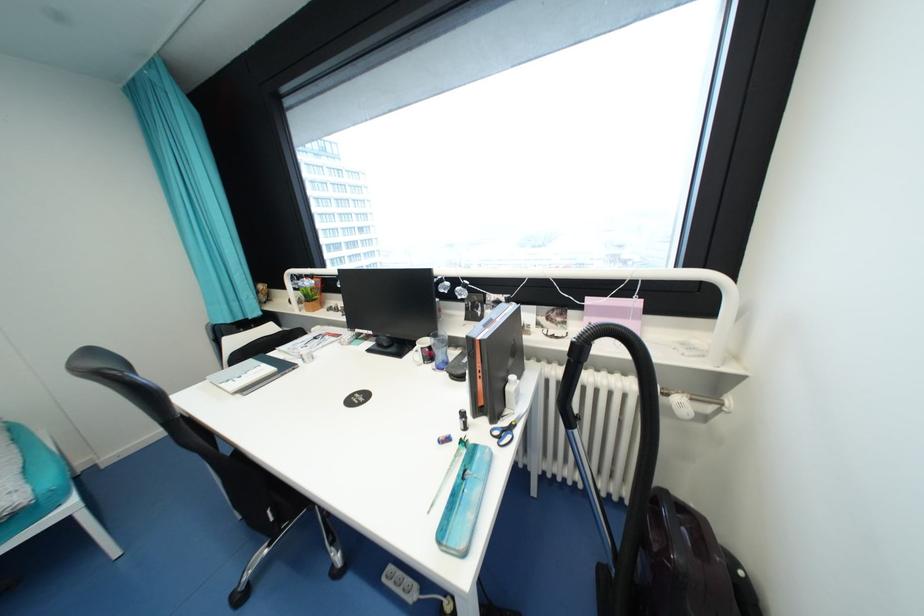
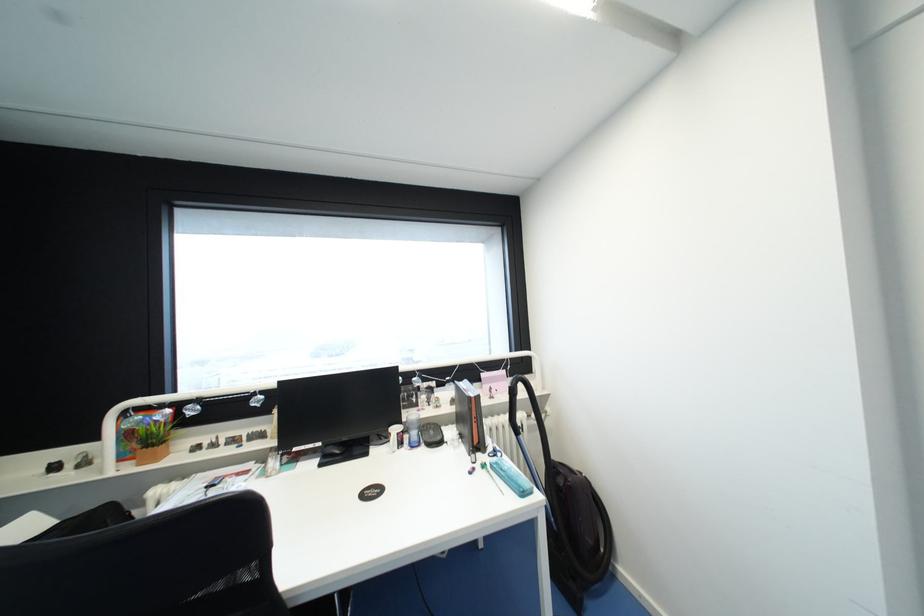
Where in the second image is the point corresponding to (x=375, y=333) from the first image?

(323, 445)